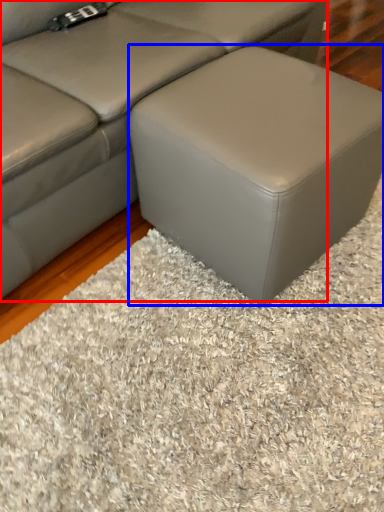
Question: Which point is closer to the camera, studio couch (highlighted by a red box) or stool (highlighted by a blue box)?

Choices:
 (A) studio couch
 (B) stool

Answer: (A)